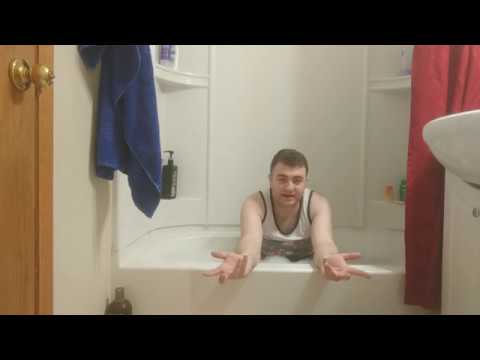
Where is `wood moulding`? wood moulding is located at coordinates pos(48,212).